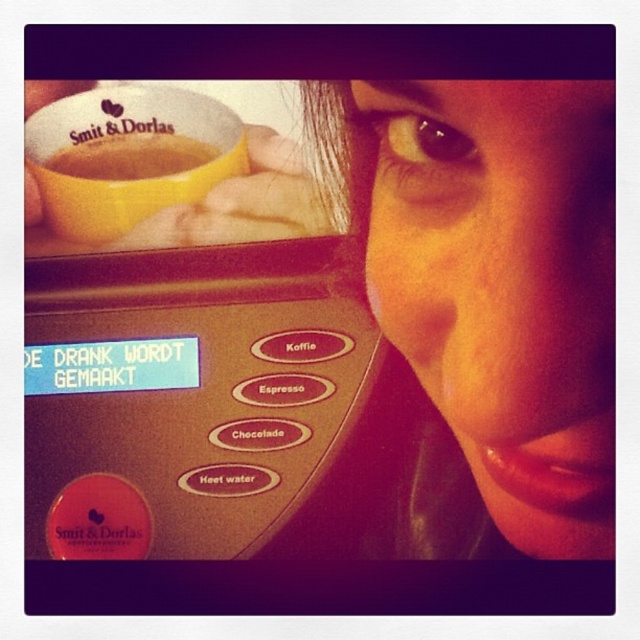
Does smooth skin face at upper right have a lesser width compared to yellow matte cup at upper left?

Indeed, smooth skin face at upper right has a lesser width compared to yellow matte cup at upper left.

Looking at this image, is smooth skin face at upper right taller than yellow matte cup at upper left?

Correct, smooth skin face at upper right is much taller as yellow matte cup at upper left.

Is point (390, 260) in front of point (99, 152)?

Yes, it is in front of point (99, 152).

At what (x,y) coordinates should I click in order to perform the action: click on smooth skin face at upper right. Please return your answer as a coordinate pair (x, y). The width and height of the screenshot is (640, 640). Looking at the image, I should click on (506, 288).

Between smooth skin face at upper right and golden plastic cup at upper left, which one appears on the left side from the viewer's perspective?

golden plastic cup at upper left is more to the left.

Does smooth skin face at upper right appear on the right side of golden plastic cup at upper left?

Indeed, smooth skin face at upper right is positioned on the right side of golden plastic cup at upper left.

Which is in front, point (516, 285) or point (148, 154)?

Point (516, 285) is in front.

This screenshot has width=640, height=640. I want to click on smooth skin face at upper right, so click(x=506, y=288).

Does yellow matte cup at upper left have a smaller size compared to golden plastic cup at upper left?

No.

Identify the location of yellow matte cup at upper left. This screenshot has width=640, height=640. (122, 150).